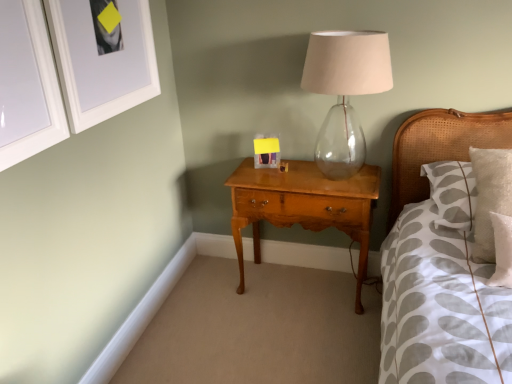
Image resolution: width=512 pixels, height=384 pixels. What are the coordinates of `vacant region to the right of matte plastic picture frame at center, placed as the third picture frame when sorted from left to right` in the screenshot? It's located at (296, 166).